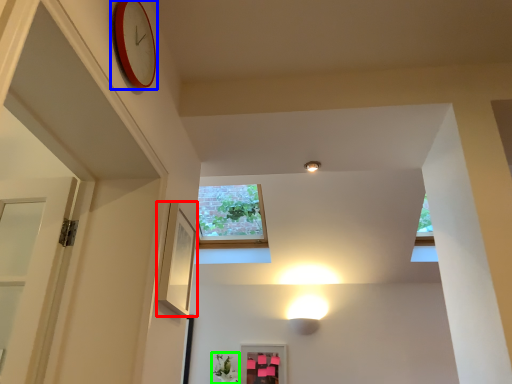
Question: Which object is positioned closest to picture frame (highlighted by a red box)? Select from clock (highlighted by a blue box) and plant (highlighted by a green box).

Choices:
 (A) clock
 (B) plant

Answer: (A)